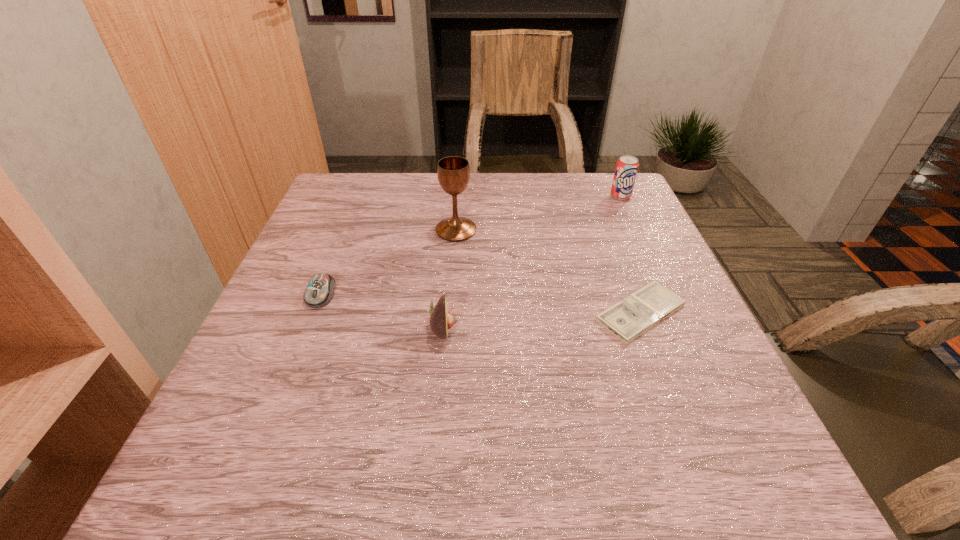
Find the location of a particular element. Image resolution: width=960 pixels, height=540 pixels. free space located 0.300m on the wheel side of the second shortest object is located at coordinates (258, 454).

Identify the location of vacant space situated 0.270m on the back of the shortest object. (x=603, y=214).

Identify the location of chalice present at the far edge. (453, 172).

Identify the location of soda can that is positioned at the far edge. The width and height of the screenshot is (960, 540). (627, 166).

Locate an element on the screen. object at the left edge is located at coordinates (x=319, y=292).

Where is `soda can situated at the right edge`? soda can situated at the right edge is located at coordinates (627, 166).

Where is `dollar located in the right edge section of the desktop`? This screenshot has width=960, height=540. dollar located in the right edge section of the desktop is located at coordinates (634, 315).

The height and width of the screenshot is (540, 960). Identify the location of object located at the far right corner. (627, 166).

Where is `vacant space at the far edge of the desktop`? The height and width of the screenshot is (540, 960). vacant space at the far edge of the desktop is located at coordinates 437,199.

In the image, there is a desktop. Where is `free space at the near edge`? free space at the near edge is located at coordinates (300, 471).